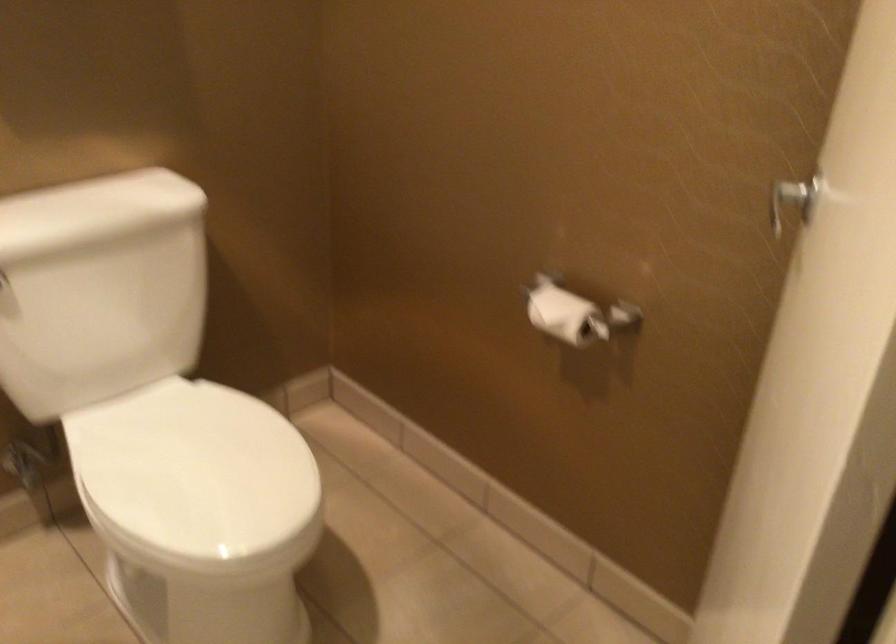
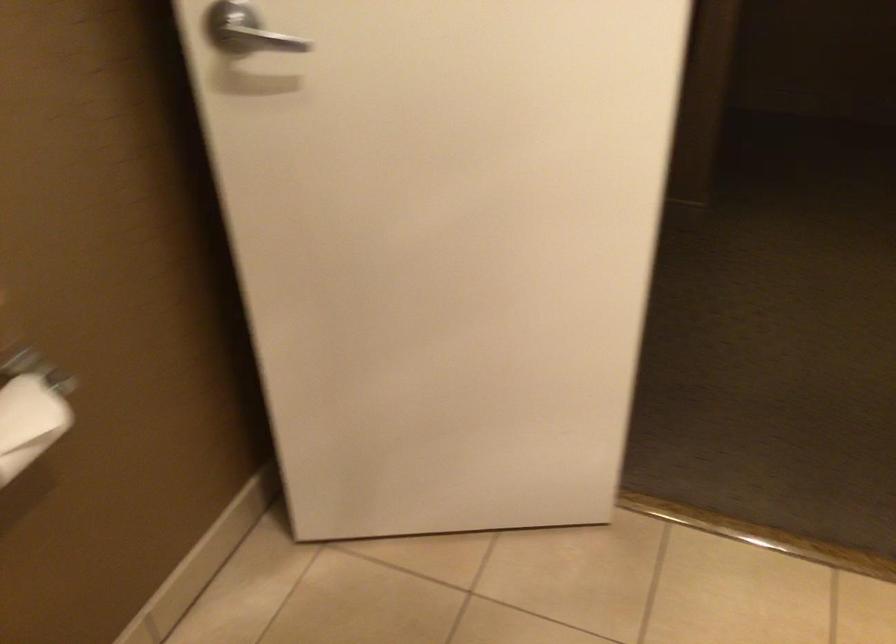
The point at (769, 238) is marked in the first image. Where is the corresponding point in the second image?

(257, 39)